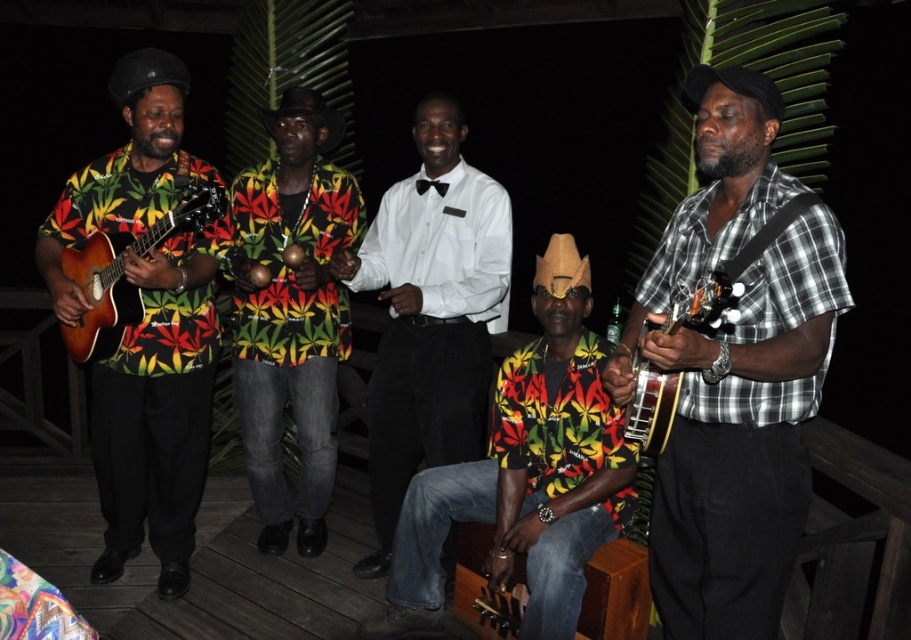
You are a photographer setting up for a night shoot at the wooden deck. You need to focus your camera on the printed fabric shirt at center and the matte wood guitar at left. Which object should you adjust the focus for first if you want to ensure both are in focus, considering their sizes?

The printed fabric shirt at center is thinner than the matte wood guitar at left, so you should focus on the thinner printed fabric shirt at center first to ensure both are in focus.

You are a photographer setting up for a night shoot at the wooden deck. You need to ensure that the white glossy shirt at center and the matte wood guitar at left are both visible in your frame. Given their sizes, which object should you prioritize placing closer to the camera to maintain clarity?

The white glossy shirt at center should be placed closer to the camera because its width is smaller than the matte wood guitar at left, ensuring both are clearly visible in the frame.

You are a photographer standing at the back of the deck. You want to take a photo of the white glossy shirt at center and the matte wood guitar at left. Which object will be more visible in your photo?

The white glossy shirt at center will be more visible in the photo because it is much taller than the matte wood guitar at left, making it stand out more in the frame.